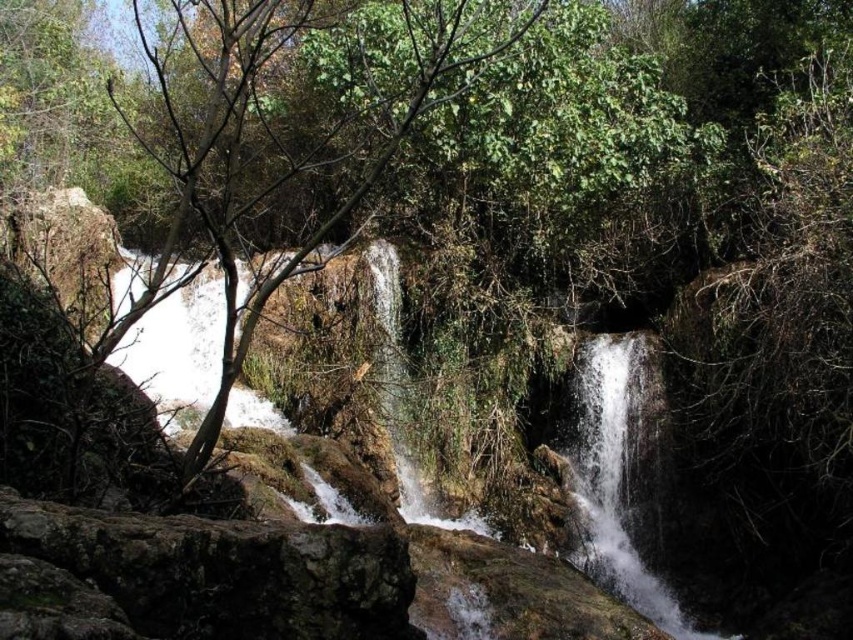
Question: Is rough textured rock at center below white frothy water at center?

Choices:
 (A) yes
 (B) no

Answer: (A)

Question: Is white frothy water at center bigger than clear water at center?

Choices:
 (A) yes
 (B) no

Answer: (A)

Question: Is white frothy water at center below clear water at center?

Choices:
 (A) yes
 (B) no

Answer: (B)

Question: Which object appears farthest from the camera in this image?

Choices:
 (A) rough textured rock at center
 (B) clear water at center
 (C) white frothy water at center

Answer: (B)

Question: Which object is closer to the camera taking this photo?

Choices:
 (A) rough textured rock at center
 (B) clear water at center
 (C) white frothy water at center

Answer: (A)

Question: Among these objects, which one is farthest from the camera?

Choices:
 (A) white frothy water at center
 (B) rough textured rock at center
 (C) clear water at center

Answer: (C)